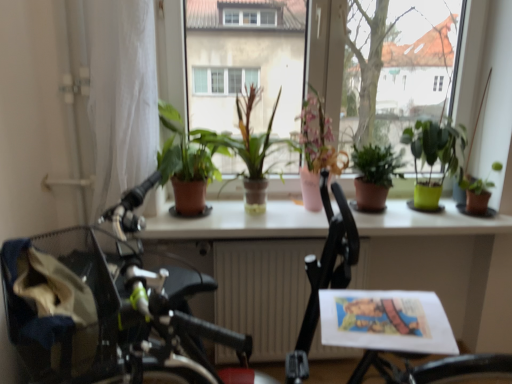
The height and width of the screenshot is (384, 512). Identify the location of free area in between green matte plant at center, the fourth houseplant viewed from the left, and green plastic pot at right, the fifth houseplant positioned from the left. (433, 217).